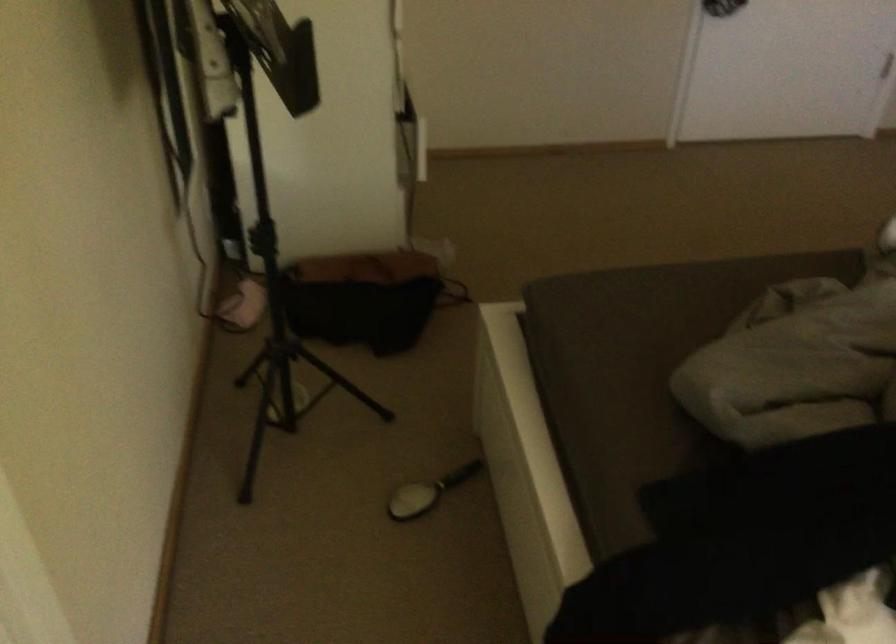
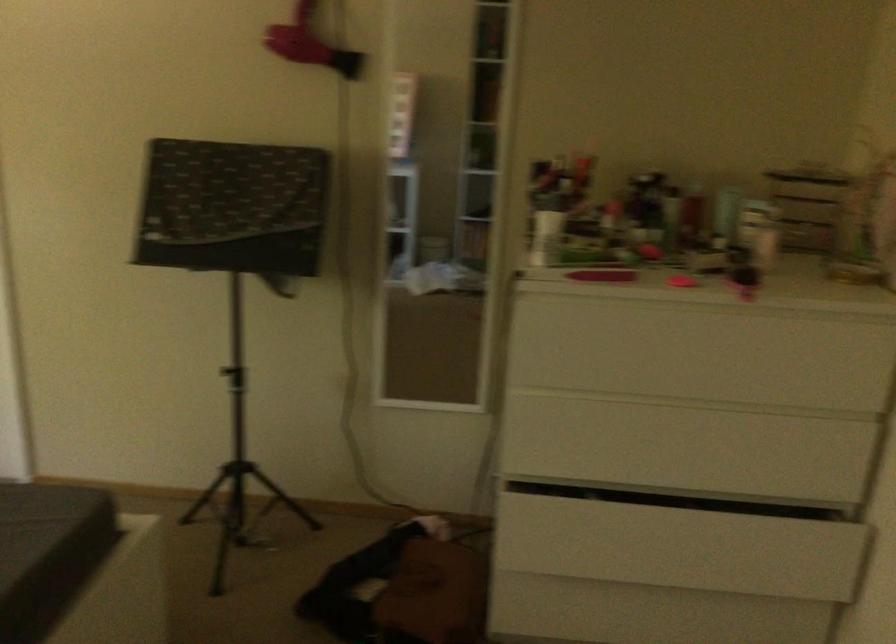
In the second image, find the point that corresponds to the point at 642,296 in the first image.

(38, 523)